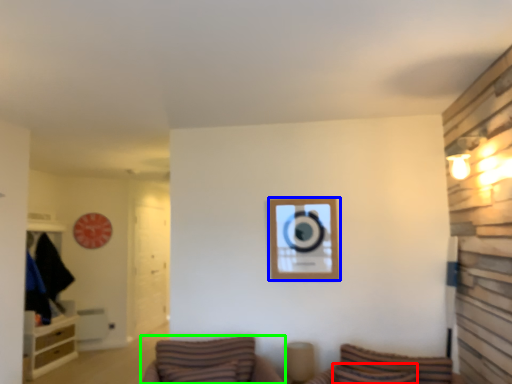
Question: Considering the real-world distances, which object is farthest from pillow (highlighted by a red box)? picture frame (highlighted by a blue box) or furniture (highlighted by a green box)?

Choices:
 (A) picture frame
 (B) furniture

Answer: (A)